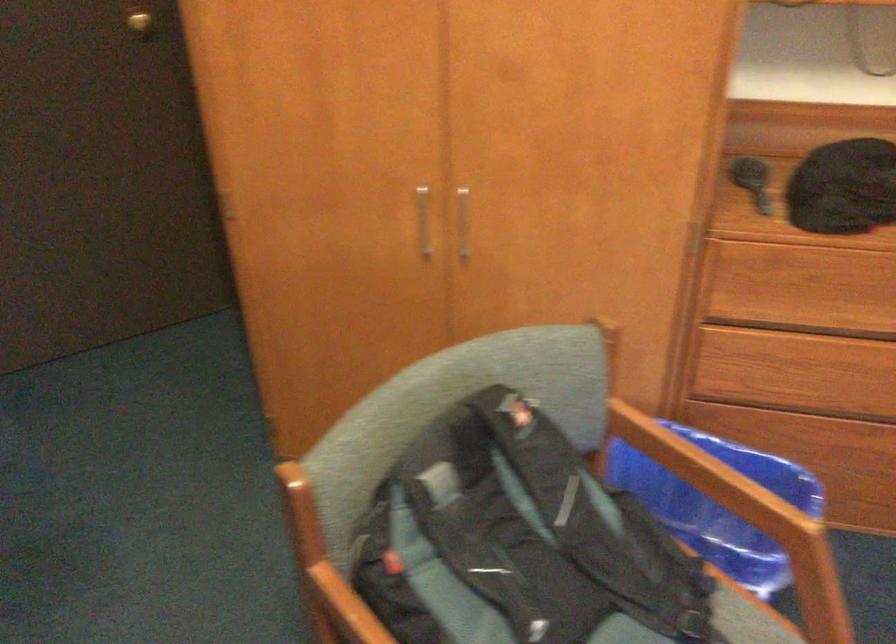
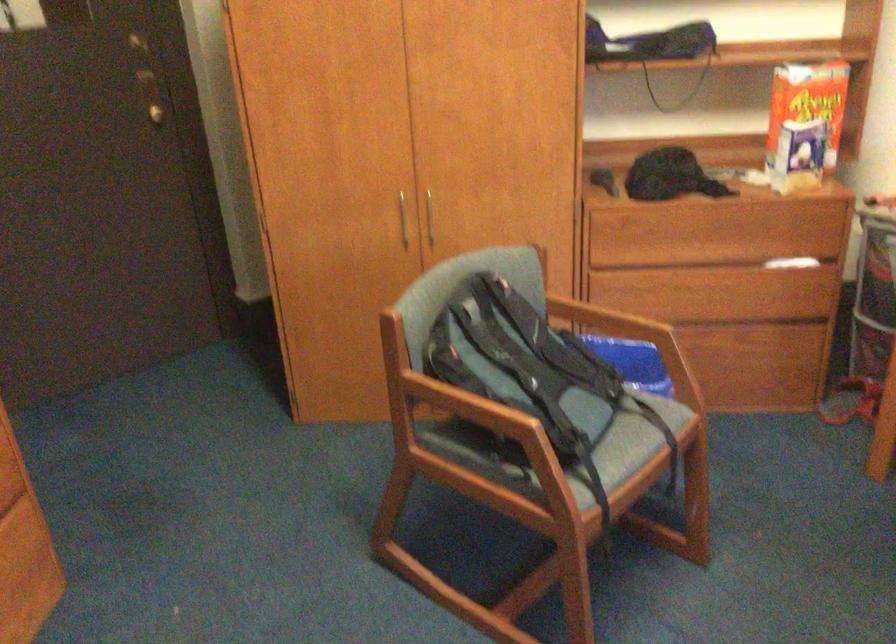
In the second image, find the point that corresponds to [712,476] in the first image.

(609, 325)